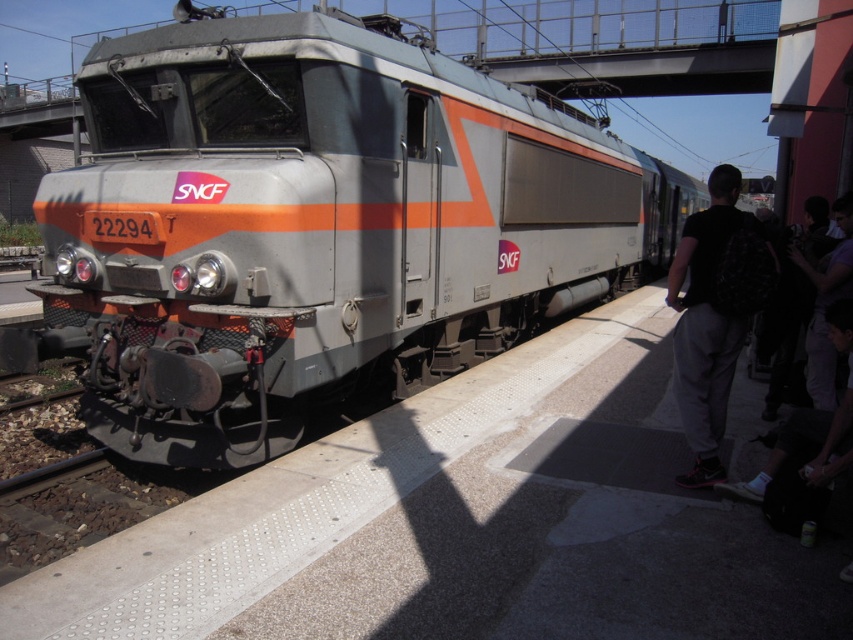
Question: Which is nearer to the dark gray sweatpants at right?

Choices:
 (A) dark purple shirt at right
 (B) metallic gray train at center

Answer: (A)

Question: From the image, what is the correct spatial relationship of metallic gray train at center in relation to dark gray sweatpants at right?

Choices:
 (A) above
 (B) below

Answer: (A)

Question: Can you confirm if metallic gray train at center is thinner than dark purple shirt at right?

Choices:
 (A) no
 (B) yes

Answer: (A)

Question: Which object appears closest to the camera in this image?

Choices:
 (A) metallic gray train at center
 (B) dark purple shirt at right

Answer: (A)

Question: Which object is the farthest from the dark gray sweatpants at right?

Choices:
 (A) dark purple shirt at right
 (B) metallic gray train at center

Answer: (B)

Question: Is metallic gray train at center wider than dark purple shirt at right?

Choices:
 (A) no
 (B) yes

Answer: (B)